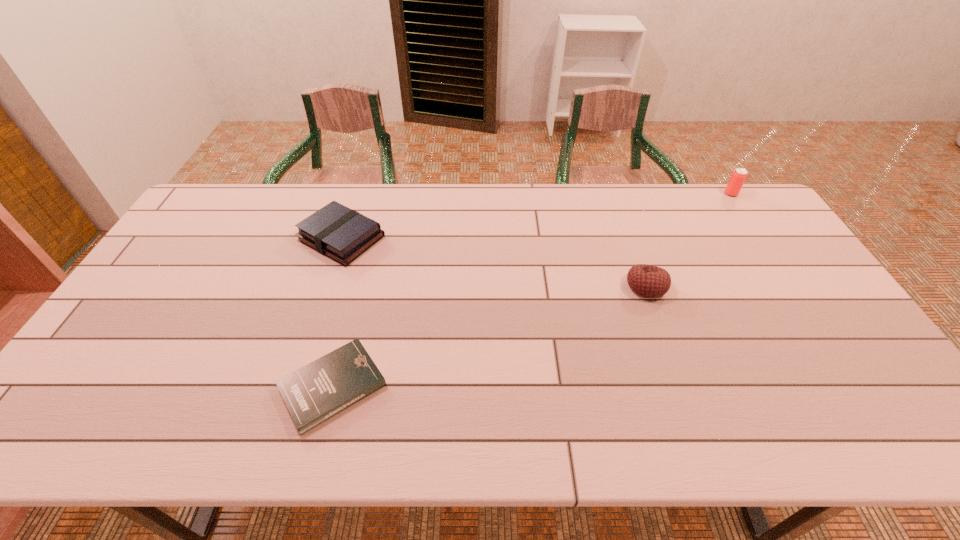
Identify the location of the tallest object. The image size is (960, 540). (738, 177).

Locate an element on the screen. beer can is located at coordinates (738, 177).

You are a GUI agent. You are given a task and a screenshot of the screen. Output one action in this format:
    pyautogui.click(x=<x>, y=<y>)
    Task: Click on the third farthest object
    The width and height of the screenshot is (960, 540).
    Given the screenshot: What is the action you would take?
    pyautogui.click(x=649, y=281)

Image resolution: width=960 pixels, height=540 pixels. In order to click on the second object from right to left in this screenshot , I will do `click(649, 281)`.

Find the location of `the second shortest object`. the second shortest object is located at coordinates (342, 234).

You are a GUI agent. You are given a task and a screenshot of the screen. Output one action in this format:
    pyautogui.click(x=<x>, y=<y>)
    Task: Click on the farther book
    This screenshot has height=540, width=960.
    Given the screenshot: What is the action you would take?
    pyautogui.click(x=342, y=234)

Where is `the shorter book`? the shorter book is located at coordinates (314, 393).

The height and width of the screenshot is (540, 960). I want to click on the shortest object, so click(314, 393).

Identify the location of blank space located on the left of the rightmost object. (614, 194).

What are the coordinates of `vacant space located 0.370m on the front of the second object from right to left` in the screenshot? It's located at (696, 428).